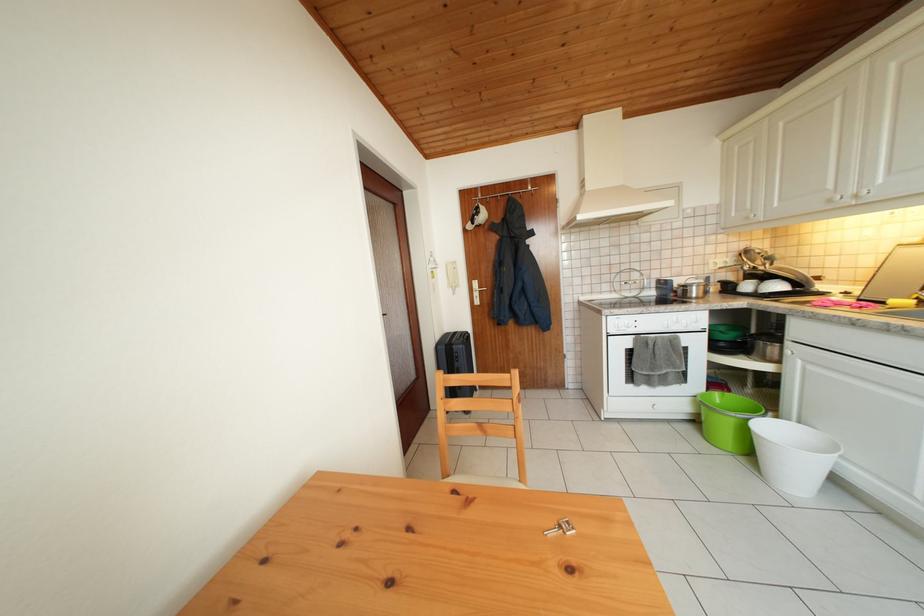
You are a GUI agent. You are given a task and a screenshot of the screen. Output one action in this format:
    pyautogui.click(x=<x>, y=<y>)
    Task: Click on the intercom handset
    The width and height of the screenshot is (924, 616).
    Given the screenshot: What is the action you would take?
    pyautogui.click(x=452, y=275)